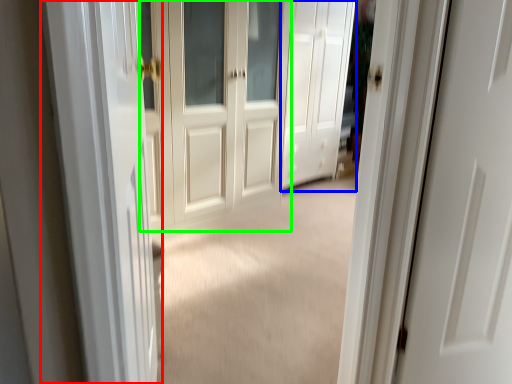
Question: Considering the real-world distances, which object is farthest from screen door (highlighted by a red box)? door (highlighted by a blue box) or door (highlighted by a green box)?

Choices:
 (A) door
 (B) door

Answer: (A)